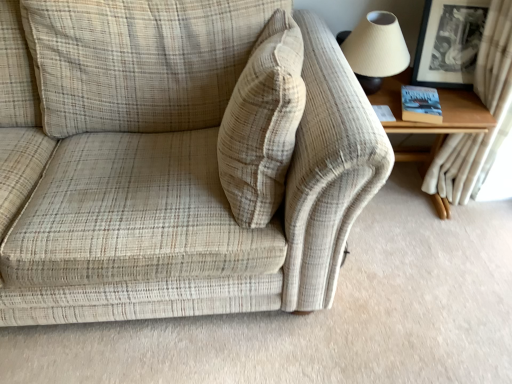
Question: Does wooden table at right have a lesser width compared to beige plaid fabric couch at center?

Choices:
 (A) yes
 (B) no

Answer: (A)

Question: Is wooden table at right looking in the opposite direction of beige plaid fabric couch at center?

Choices:
 (A) no
 (B) yes

Answer: (A)

Question: Are wooden table at right and beige plaid fabric couch at center making contact?

Choices:
 (A) no
 (B) yes

Answer: (A)

Question: Considering the relative sizes of wooden table at right and beige plaid fabric couch at center in the image provided, is wooden table at right bigger than beige plaid fabric couch at center?

Choices:
 (A) yes
 (B) no

Answer: (B)

Question: From the image's perspective, does wooden table at right appear higher than beige plaid fabric couch at center?

Choices:
 (A) no
 (B) yes

Answer: (B)

Question: From a real-world perspective, is white textured curtain at upper right above or below matte beige lampshade at upper right?

Choices:
 (A) above
 (B) below

Answer: (B)

Question: Is white textured curtain at upper right wider or thinner than matte beige lampshade at upper right?

Choices:
 (A) thin
 (B) wide

Answer: (B)

Question: Is white textured curtain at upper right spatially inside matte beige lampshade at upper right, or outside of it?

Choices:
 (A) outside
 (B) inside

Answer: (A)

Question: From their relative heights in the image, would you say white textured curtain at upper right is taller or shorter than matte beige lampshade at upper right?

Choices:
 (A) tall
 (B) short

Answer: (A)

Question: From a real-world perspective, is beige plaid fabric couch at center physically located above or below black glossy picture frame at upper right?

Choices:
 (A) below
 (B) above

Answer: (A)

Question: In terms of width, does beige plaid fabric couch at center look wider or thinner when compared to black glossy picture frame at upper right?

Choices:
 (A) thin
 (B) wide

Answer: (B)

Question: Is beige plaid fabric couch at center to the left or to the right of black glossy picture frame at upper right in the image?

Choices:
 (A) left
 (B) right

Answer: (A)

Question: Would you say beige plaid fabric couch at center is inside or outside black glossy picture frame at upper right?

Choices:
 (A) inside
 (B) outside

Answer: (B)

Question: Is matte beige lampshade at upper right in front of or behind beige corduroy pillow at center in the image?

Choices:
 (A) front
 (B) behind

Answer: (B)

Question: Is matte beige lampshade at upper right bigger or smaller than beige corduroy pillow at center?

Choices:
 (A) small
 (B) big

Answer: (A)